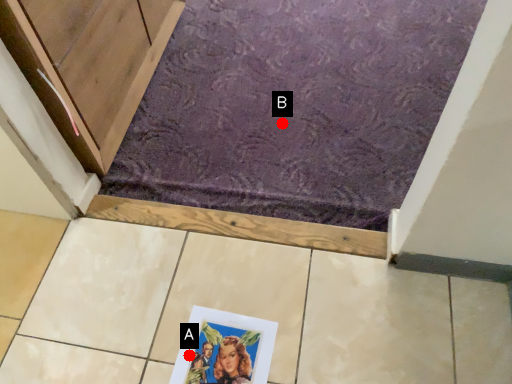
Question: Two points are circled on the image, labeled by A and B beside each circle. Which point appears farthest from the camera in this image?

Choices:
 (A) A is further
 (B) B is further

Answer: (B)